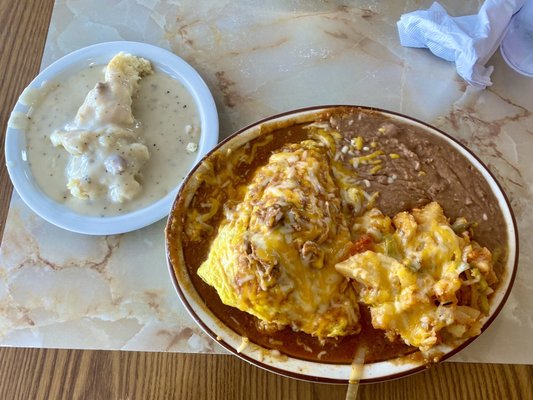
Find the location of a particular element. This screenshot has height=400, width=533. placemat is located at coordinates (94, 291).